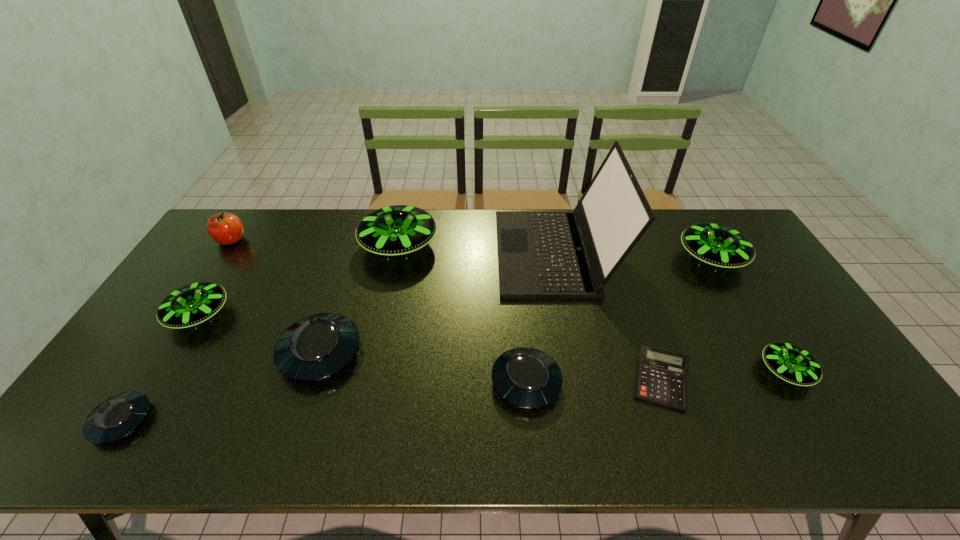
You are a GUI agent. You are given a task and a screenshot of the screen. Output one action in this format:
    pyautogui.click(x=<x>, y=<y>)
    Task: Click on the object that is the nearest to the second nearest green saucer
    
    Given the screenshot: What is the action you would take?
    pyautogui.click(x=115, y=418)

Choose which object is the eighth nearest neighbor to the shortest object. Please provide its 2D coordinates. Your answer should be formatted as a tuple, i.e. [(x, y)], where the tuple contains the x and y coordinates of a point satisfying the conditions above.

[(115, 418)]

Choose which saucer is the sixth nearest neighbor to the shortest object. Please provide its 2D coordinates. Your answer should be formatted as a tuple, i.e. [(x, y)], where the tuple contains the x and y coordinates of a point satisfying the conditions above.

[(192, 304)]

Select which saucer appears as the fourth closest to the second smallest gray saucer. Please provide its 2D coordinates. Your answer should be formatted as a tuple, i.e. [(x, y)], where the tuple contains the x and y coordinates of a point satisfying the conditions above.

[(717, 245)]

Locate which green saucer is the fourth closest to the rightmost gray saucer. Please provide its 2D coordinates. Your answer should be formatted as a tuple, i.e. [(x, y)], where the tuple contains the x and y coordinates of a point satisfying the conditions above.

[(192, 304)]

Locate an element on the screen. Image resolution: width=960 pixels, height=540 pixels. green saucer that is the second closest to the second gray saucer from right to left is located at coordinates (396, 230).

Identify which gray saucer is the third nearest to the second smallest green saucer. Please provide its 2D coordinates. Your answer should be formatted as a tuple, i.e. [(x, y)], where the tuple contains the x and y coordinates of a point satisfying the conditions above.

[(526, 377)]

Identify which gray saucer is the third closest to the second tallest object. Please provide its 2D coordinates. Your answer should be formatted as a tuple, i.e. [(x, y)], where the tuple contains the x and y coordinates of a point satisfying the conditions above.

[(115, 418)]

This screenshot has width=960, height=540. What are the coordinates of `free space in the image that satisfies the following two spatial constraints: 1. on the front side of the second gray saucer from right to left; 2. on the left side of the fifth saucer from left to right` in the screenshot? It's located at (311, 382).

The height and width of the screenshot is (540, 960). I want to click on blank space that satisfies the following two spatial constraints: 1. on the front side of the shortest object; 2. on the right side of the apple, so click(138, 380).